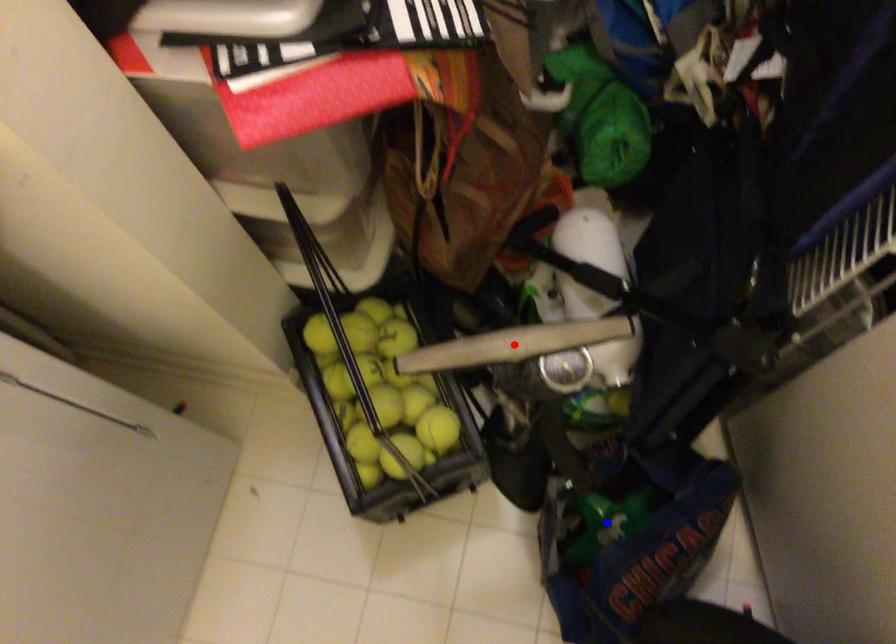
Question: Two points are marked on the image. Which point is closer to the camera?

Choices:
 (A) Blue point is closer.
 (B) Red point is closer.

Answer: (B)